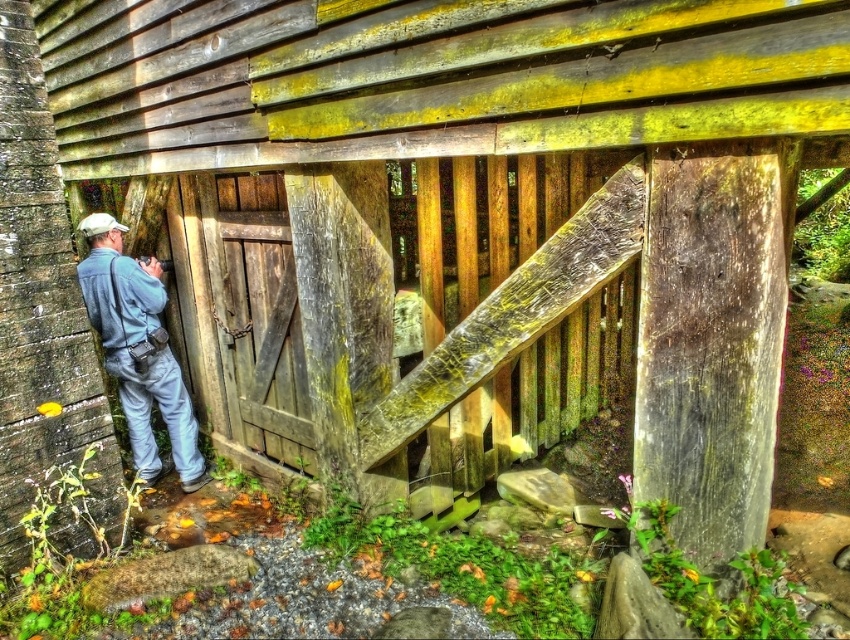
You are a photographer standing in front of the weathered wood barn door at center and the blue denim jumpsuit at left. Which object is closer to you?

The blue denim jumpsuit at left is closer to you because the weathered wood barn door at center is positioned over it, indicating it is behind and farther away.

You are standing at the entrance of the rustic wooden structure and notice two points marked on the wall. The first point is at coordinates point (276,410) and the second is at point (149,355). Which point is closer to you?

Point (276,410) is closer to the viewer than point (149,355).